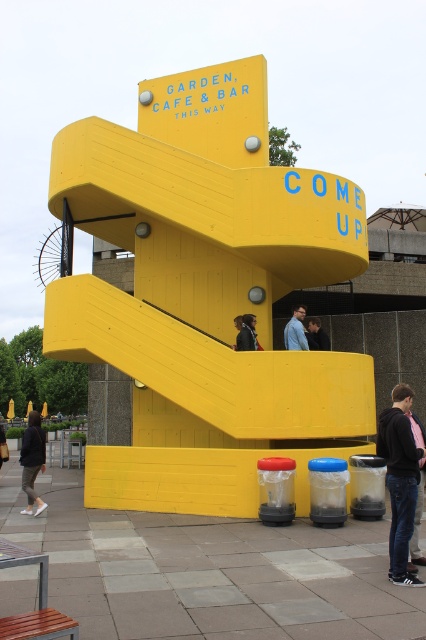
Measure the distance between dark blue jeans at lower right and camera.

dark blue jeans at lower right is 20.70 feet away from camera.

Can you confirm if dark blue jeans at lower right is smaller than blue fabric shirt at center?

Actually, dark blue jeans at lower right might be larger than blue fabric shirt at center.

What do you see at coordinates (400, 481) in the screenshot? This screenshot has width=426, height=640. I see `dark blue jeans at lower right` at bounding box center [400, 481].

This screenshot has height=640, width=426. In order to click on dark blue jeans at lower right in this screenshot , I will do `click(400, 481)`.

Does dark gray hoodie at lower left have a greater height compared to dark blue jacket at center?

Yes, dark gray hoodie at lower left is taller than dark blue jacket at center.

Describe the element at coordinates (32, 460) in the screenshot. I see `dark gray hoodie at lower left` at that location.

The image size is (426, 640). In order to click on dark gray hoodie at lower left in this screenshot , I will do `click(32, 460)`.

Between yellow wood slide at center and dark brown leather jacket at lower left, which one appears on the left side from the viewer's perspective?

dark brown leather jacket at lower left is more to the left.

Image resolution: width=426 pixels, height=640 pixels. What do you see at coordinates (206, 372) in the screenshot?
I see `yellow wood slide at center` at bounding box center [206, 372].

Find the location of a particular element. The height and width of the screenshot is (640, 426). yellow wood slide at center is located at coordinates (206, 372).